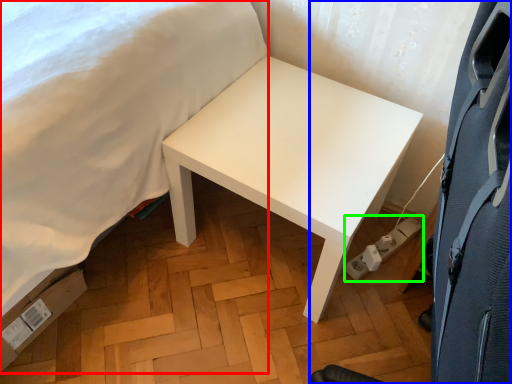
Question: Estimate the real-world distances between objects in this image. Which object is farther from bed (highlighted by a red box), swivel chair (highlighted by a blue box) or electric outlet (highlighted by a green box)?

Choices:
 (A) swivel chair
 (B) electric outlet

Answer: (B)